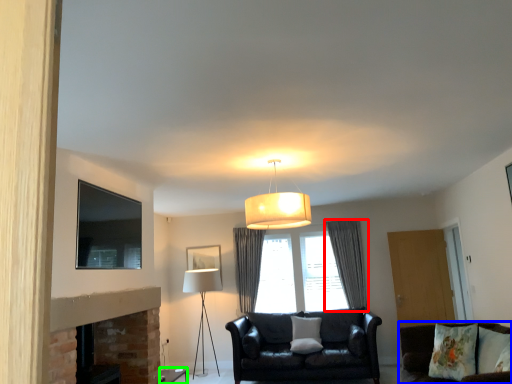
Question: Considering the real-world distances, which object is farthest from curtain (highlighted by a red box)? studio couch (highlighted by a blue box) or side table (highlighted by a green box)?

Choices:
 (A) studio couch
 (B) side table

Answer: (B)